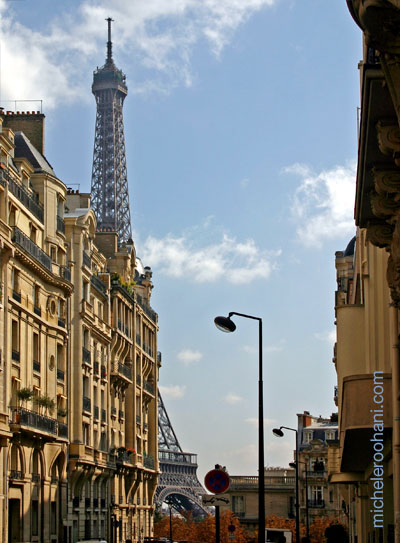
I want to click on circular windows, so click(51, 359), click(53, 304).